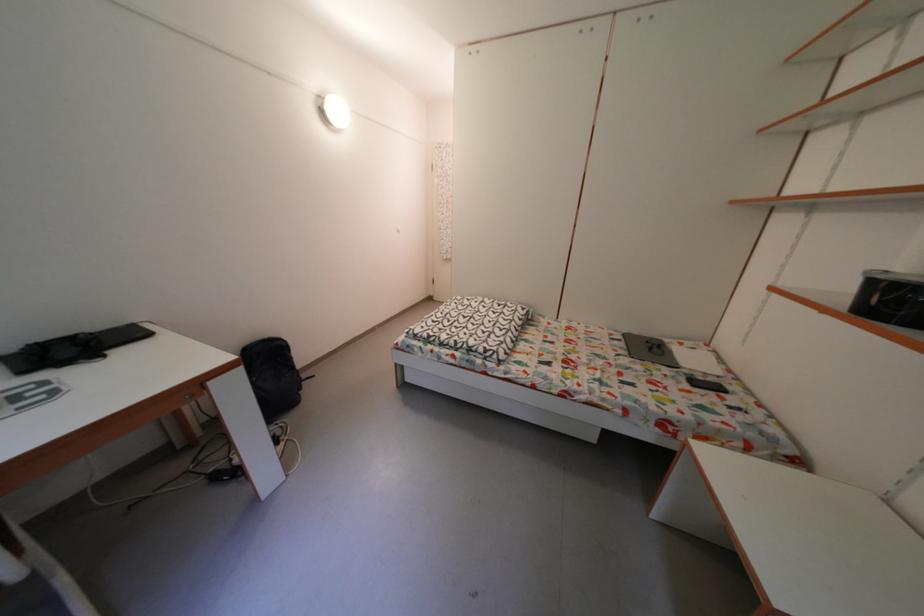
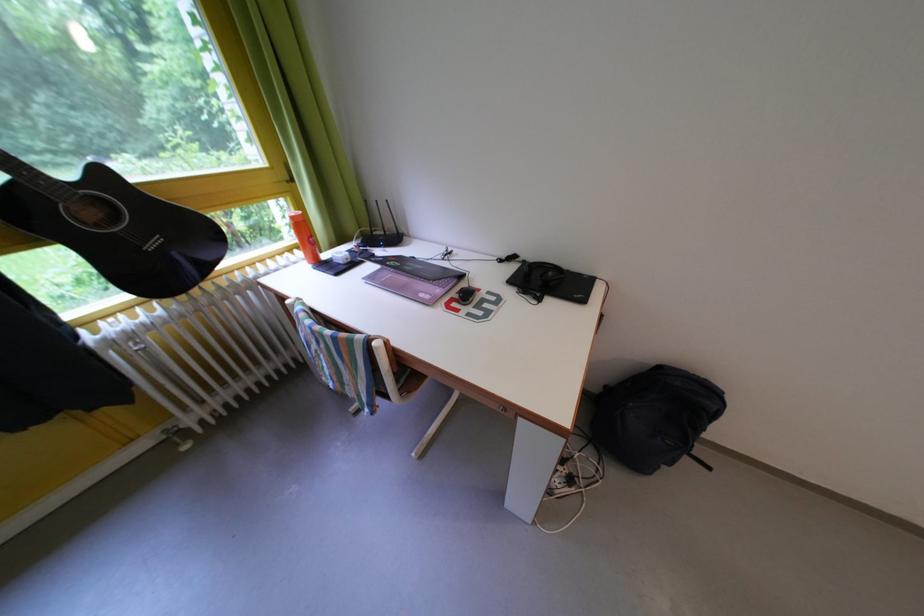
First-person continuous shooting, in which direction is the camera rotating?

The rotation direction of the camera is left-down.